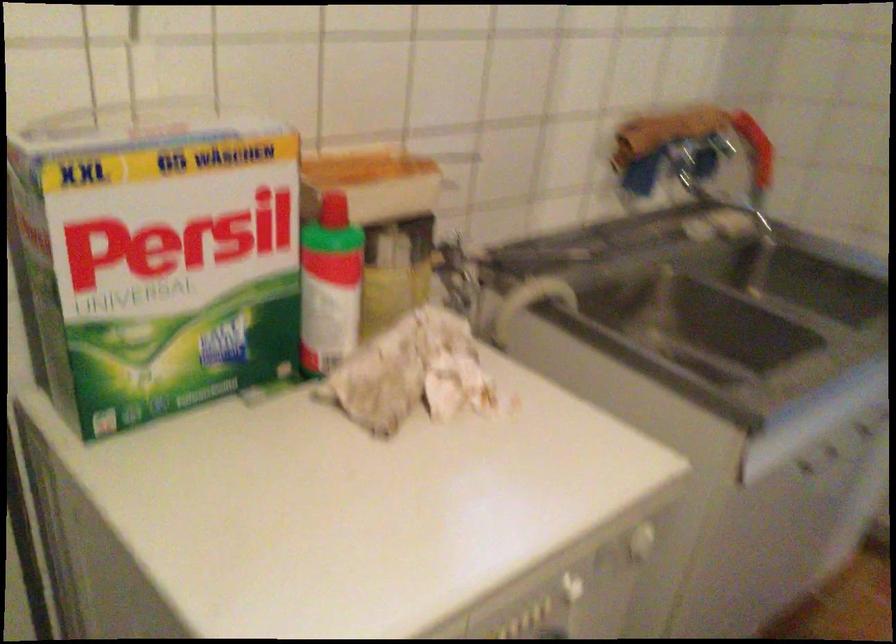
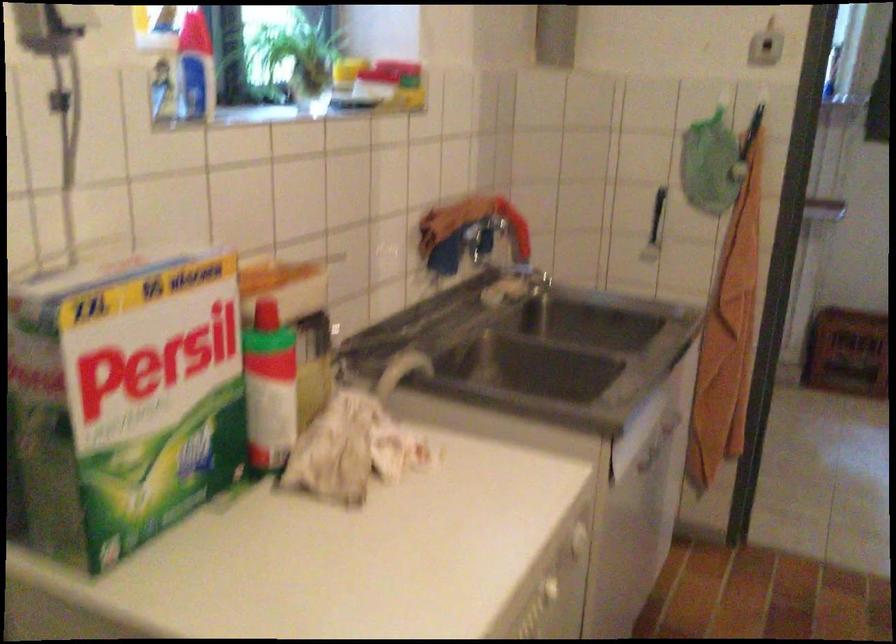
What movement of the cameraman would produce the second image?

The movement direction of the cameraman is left, backward.